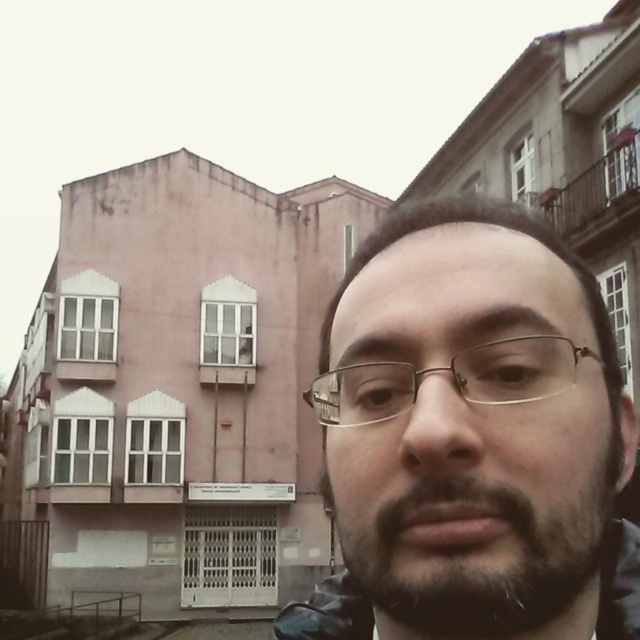
Question: Observing the image, what is the correct spatial positioning of dark brown hair at upper center in reference to metallic gold glasses at center?

Choices:
 (A) right
 (B) left

Answer: (A)

Question: Does dark brown hair at upper center appear under dark brown stubble at center?

Choices:
 (A) no
 (B) yes

Answer: (A)

Question: Which object is the closest to the dark brown stubble at center?

Choices:
 (A) dark brown hair at upper center
 (B) metallic gold glasses at center

Answer: (A)

Question: Is dark brown stubble at center bigger than metallic gold glasses at center?

Choices:
 (A) yes
 (B) no

Answer: (A)

Question: Estimate the real-world distances between objects in this image. Which object is farther from the metallic gold glasses at center?

Choices:
 (A) dark brown hair at upper center
 (B) dark brown stubble at center

Answer: (B)

Question: Among these points, which one is nearest to the camera?

Choices:
 (A) coord(556,371)
 (B) coord(605,588)

Answer: (A)